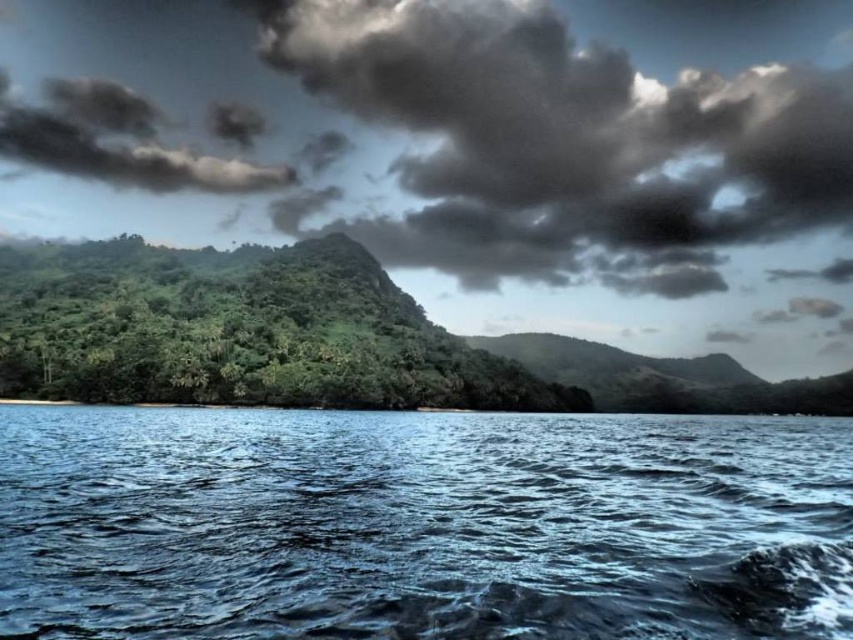
You are standing at the coast looking out at the dark gray fluffy cloud at upper center. If you were to walk straight towards it, would you eventually reach the cloud or the ocean?

Result: The dark gray fluffy cloud at upper center is 600.48 meters away from the viewer. Since clouds are located in the sky and not on the ground, walking towards it would not lead you to the cloud. Instead, you would reach the ocean first as it is part of the coastal landscape in front of you.

You are standing on a cliff overlooking the ocean and see the green leafy forest at center and the dark gray fluffy cloud at upper left. Which object is nearer to you?

The green leafy forest at center is closer to the viewer than the dark gray fluffy cloud at upper left.